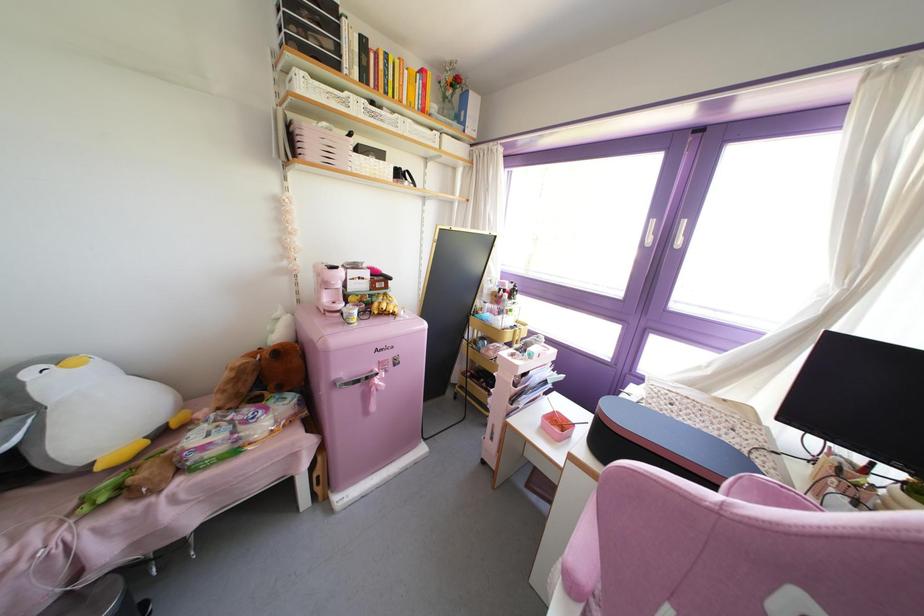
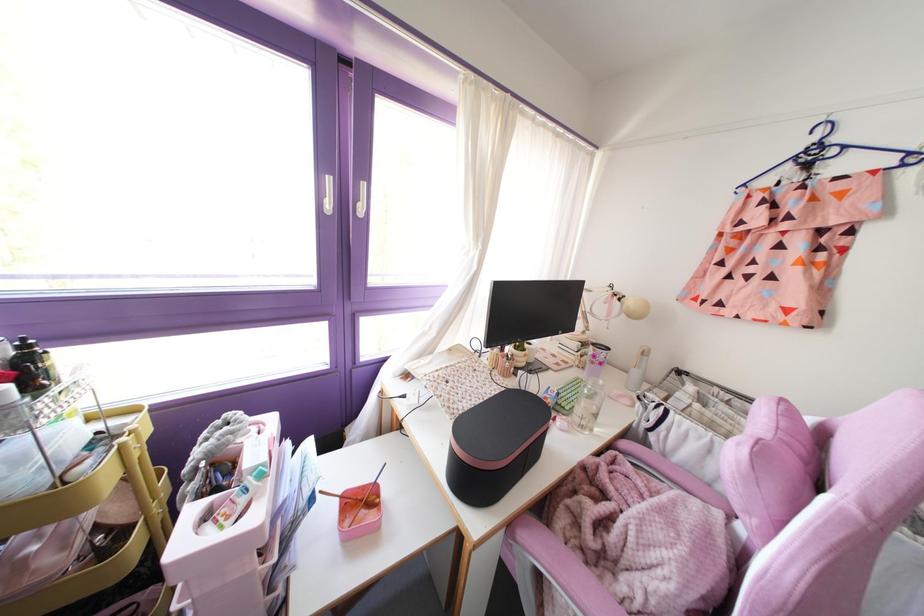
The point at [529,355] is marked in the first image. Where is the corresponding point in the second image?

(261, 475)